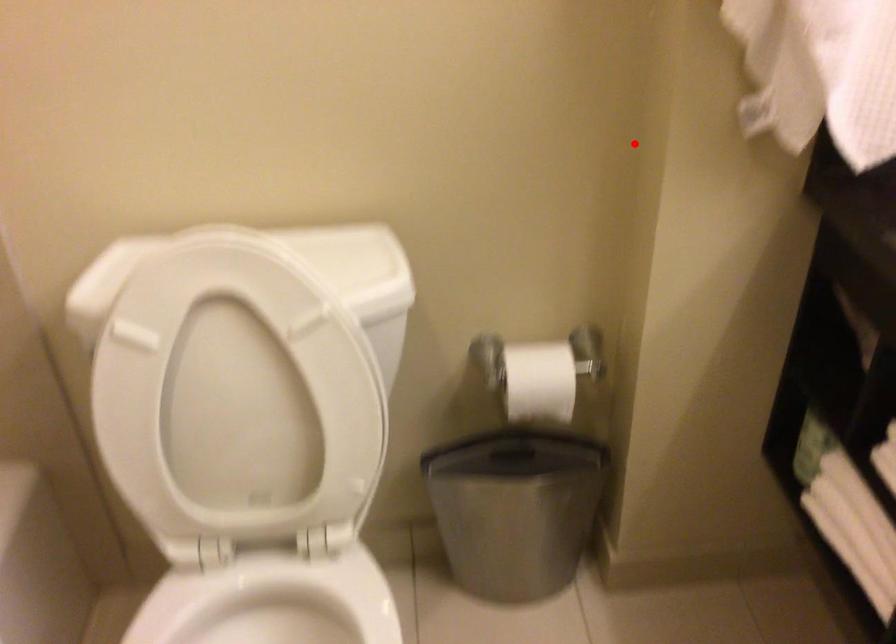
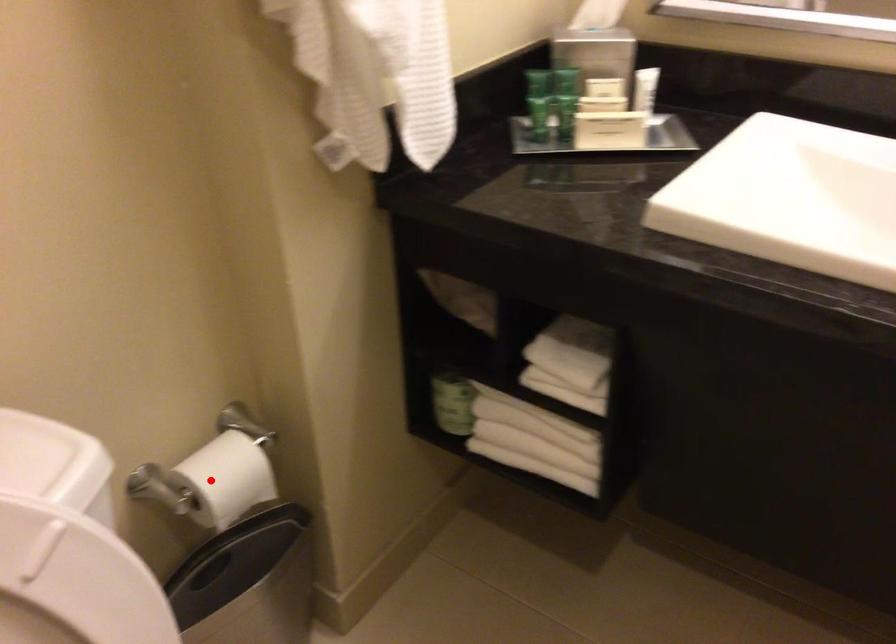
I am providing you with two images of the same scene from different viewpoints. A red point is marked on the first image and another point is marked on the second image. Are the points marked in image1 and image2 representing the same 3D position?

No